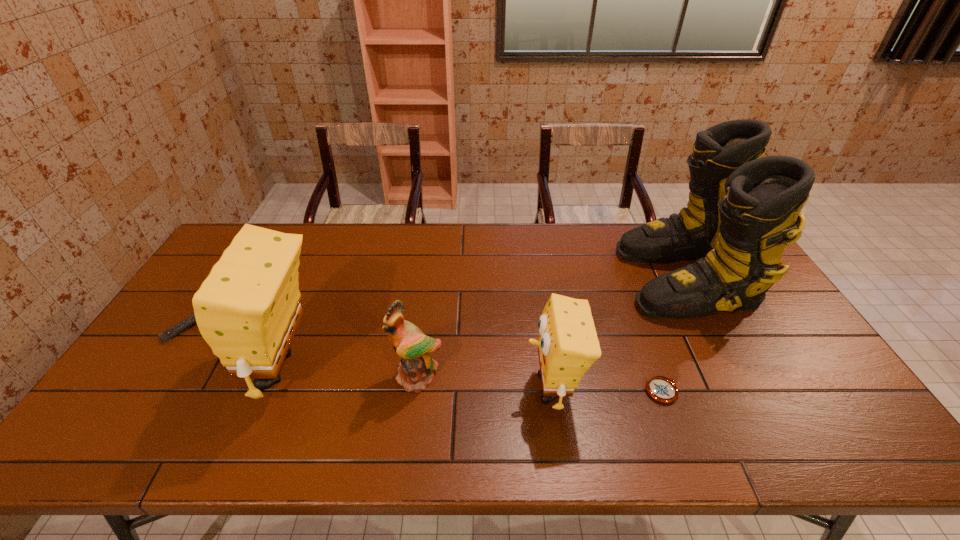
Please point a spot on the right to add another sponge. Please provide its 2D coordinates. Your answer should be formatted as a tuple, i.e. [(x, y)], where the tuple contains the x and y coordinates of a point satisfying the conditions above.

[(846, 409)]